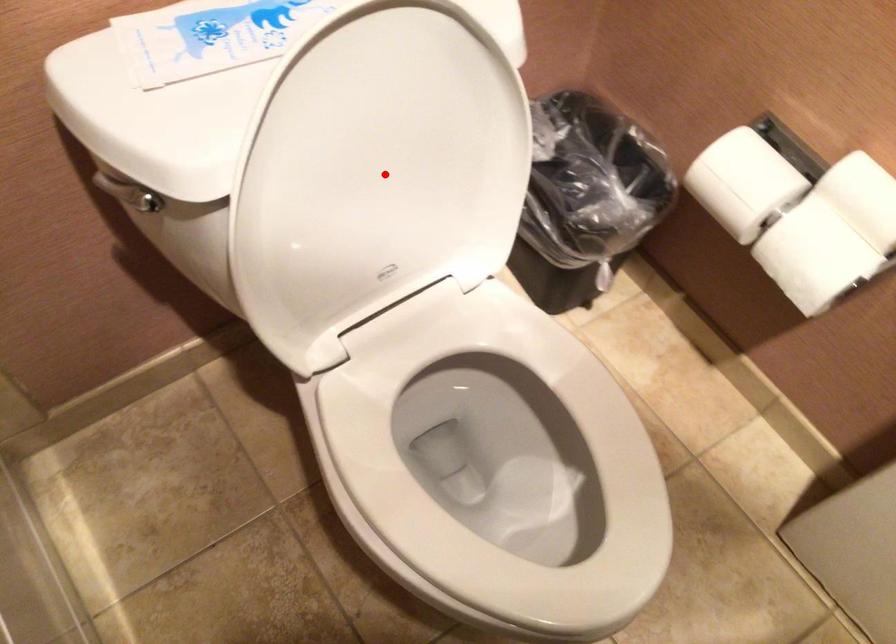
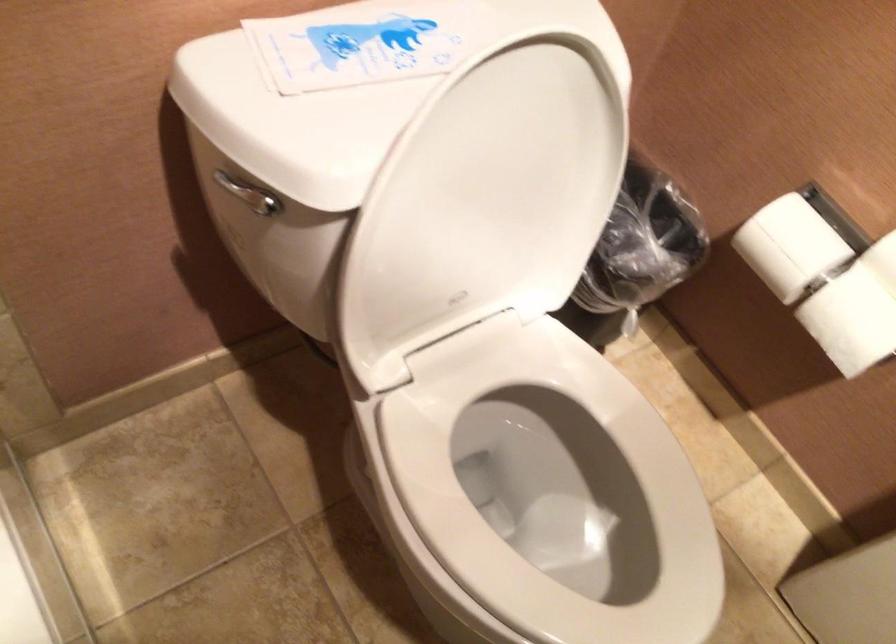
Find the pixel in the second image that matches the highlighted location in the first image.

(484, 204)